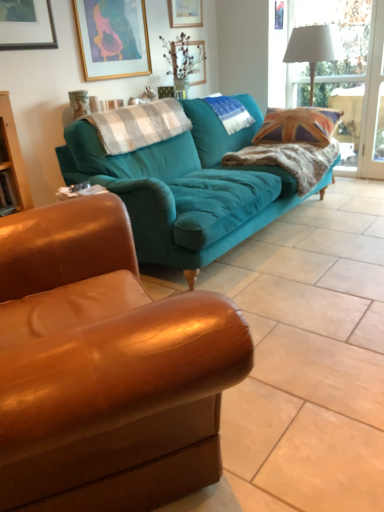
What do you see at coordinates (298, 126) in the screenshot?
I see `union jack fabric pillow at right` at bounding box center [298, 126].

What do you see at coordinates (185, 13) in the screenshot? I see `wooden picture frame at upper center, the first picture frame viewed from the top` at bounding box center [185, 13].

The image size is (384, 512). What do you see at coordinates (336, 74) in the screenshot?
I see `clear glass window at upper right` at bounding box center [336, 74].

Locate an element on the screen. The height and width of the screenshot is (512, 384). teal fabric pillow at center, acting as the 2th pillow starting from the front is located at coordinates (230, 113).

This screenshot has height=512, width=384. In order to click on union jack fabric pillow at right in this screenshot , I will do `click(298, 126)`.

Can you confirm if wooden picture frame at upper center, the 2th picture frame from the front, is bigger than teal fabric pillow at center, acting as the 2th pillow starting from the front?

No, wooden picture frame at upper center, the 2th picture frame from the front, is not bigger than teal fabric pillow at center, acting as the 2th pillow starting from the front.

Is wooden picture frame at upper center, the 2th picture frame from the front, not near teal fabric pillow at center, the first pillow when ordered from right to left?

No, wooden picture frame at upper center, the 2th picture frame from the front, is in close proximity to teal fabric pillow at center, the first pillow when ordered from right to left.

How different are the orientations of wooden picture frame at upper center, the 1th picture frame in the right-to-left sequence, and teal fabric pillow at center, acting as the 2th pillow starting from the front, in degrees?

The angle between the facing direction of wooden picture frame at upper center, the 1th picture frame in the right-to-left sequence, and the facing direction of teal fabric pillow at center, acting as the 2th pillow starting from the front, is 0.633 degrees.

Is point (180, 11) farther from viewer compared to point (243, 124)?

Yes, it is.

Is plaid fabric pillow at center, which appears as the 1th pillow when viewed from the front, wider than teal fabric pillow at center, acting as the 2th pillow starting from the front?

No.

Is point (99, 134) more distant than point (245, 124)?

No, it is in front of (245, 124).

Considering the sizes of objects plaid fabric pillow at center, which appears as the 1th pillow when viewed from the front, and teal fabric pillow at center, the first pillow when ordered from right to left, in the image provided, who is bigger, plaid fabric pillow at center, which appears as the 1th pillow when viewed from the front, or teal fabric pillow at center, the first pillow when ordered from right to left,?

Bigger between the two is teal fabric pillow at center, the first pillow when ordered from right to left.

How different are the orientations of teal fabric couch at center, arranged as the 2th studio couch when viewed from the back, and union jack fabric pillow at right in degrees?

The facing directions of teal fabric couch at center, arranged as the 2th studio couch when viewed from the back, and union jack fabric pillow at right are 58.8 degrees apart.

Does teal fabric couch at center, arranged as the 2th studio couch when viewed from the back, appear on the left side of union jack fabric pillow at right?

Correct, you'll find teal fabric couch at center, arranged as the 2th studio couch when viewed from the back, to the left of union jack fabric pillow at right.

Is teal fabric couch at center, arranged as the 2th studio couch when viewed from the back, wider than union jack fabric pillow at right?

Incorrect, the width of teal fabric couch at center, arranged as the 2th studio couch when viewed from the back, does not surpass that of union jack fabric pillow at right.

Considering the sizes of teal fabric couch at center, the first studio couch when ordered from front to back, and union jack fabric pillow at right in the image, is teal fabric couch at center, the first studio couch when ordered from front to back, bigger or smaller than union jack fabric pillow at right?

In the image, teal fabric couch at center, the first studio couch when ordered from front to back, appears to be larger than union jack fabric pillow at right.

From a real-world perspective, which is physically above, teal fabric pillow at center, the first pillow when ordered from right to left, or teal fabric couch at center, the 1th studio couch positioned from the back?

From a 3D spatial view, teal fabric pillow at center, the first pillow when ordered from right to left, is above.

From the picture: From the image's perspective, between teal fabric pillow at center, which is the second pillow from left to right, and teal fabric couch at center, the 1th studio couch positioned from the back, who is located below?

teal fabric couch at center, the 1th studio couch positioned from the back, is shown below in the image.

Which of these two, teal fabric pillow at center, the first pillow when ordered from right to left, or teal fabric couch at center, the 1th studio couch positioned from the back, is wider?

Wider between the two is teal fabric couch at center, the 1th studio couch positioned from the back.

In the scene shown: Does teal fabric pillow at center, the first pillow when ordered from right to left, have a greater height compared to teal fabric couch at center, marked as the second studio couch in a front-to-back arrangement?

No, teal fabric pillow at center, the first pillow when ordered from right to left, is not taller than teal fabric couch at center, marked as the second studio couch in a front-to-back arrangement.

Between teal fabric couch at center, the 1th studio couch positioned from the back, and teal fabric pillow at center, the first pillow when ordered from right to left, which one is positioned in front?

teal fabric couch at center, the 1th studio couch positioned from the back, is in front.

Which object is positioned more to the right, teal fabric couch at center, the 1th studio couch positioned from the back, or teal fabric pillow at center, acting as the 2th pillow starting from the front?

teal fabric pillow at center, acting as the 2th pillow starting from the front.

How different are the orientations of teal fabric couch at center, marked as the second studio couch in a front-to-back arrangement, and teal fabric pillow at center, which is the second pillow from left to right, in degrees?

0.775 degrees separate the facing orientations of teal fabric couch at center, marked as the second studio couch in a front-to-back arrangement, and teal fabric pillow at center, which is the second pillow from left to right.

Is clear glass window at upper right not near gold-framed artwork at upper center, which is the 2th picture frame from right to left?

Yes, clear glass window at upper right and gold-framed artwork at upper center, which is the 2th picture frame from right to left, are quite far apart.

Is clear glass window at upper right in front of or behind gold-framed artwork at upper center, placed as the second picture frame when sorted from back to front, in the image?

Visually, clear glass window at upper right is located behind gold-framed artwork at upper center, placed as the second picture frame when sorted from back to front.

Is point (335, 74) in front of point (112, 25)?

No.

Is clear glass window at upper right at the right side of gold-framed artwork at upper center, which is counted as the 1th picture frame, starting from the front?

Indeed, clear glass window at upper right is positioned on the right side of gold-framed artwork at upper center, which is counted as the 1th picture frame, starting from the front.

Which is closer, (280,112) or (17,296)?

The point (17,296) is more forward.

Could you tell me if union jack fabric pillow at right is facing teal fabric couch at center, the first studio couch when ordered from front to back?

No, union jack fabric pillow at right is not facing towards teal fabric couch at center, the first studio couch when ordered from front to back.

How distant is union jack fabric pillow at right from teal fabric couch at center, arranged as the 2th studio couch when viewed from the back?

They are 7.54 feet apart.

Consider the image. Between union jack fabric pillow at right and teal fabric couch at center, arranged as the 2th studio couch when viewed from the back, which one has larger width?

With larger width is union jack fabric pillow at right.

From the image's perspective, starting from the wooden picture frame at upper center, placed as the second picture frame when sorted from left to right, which pillow is the 1st one below? Please provide its 2D coordinates.

[(230, 113)]

At what (x,y) coordinates should I click in order to perform the action: click on pillow to the right of plaid fabric pillow at center, which ranks as the second pillow in back-to-front order. Please return your answer as a coordinate pair (x, y). Looking at the image, I should click on (230, 113).

Considering their positions, is teal fabric pillow at center, the 1th pillow when ordered from back to front, positioned closer to gold-framed artwork at upper center, acting as the first picture frame starting from the left, than union jack fabric pillow at right?

teal fabric pillow at center, the 1th pillow when ordered from back to front, lies closer to gold-framed artwork at upper center, acting as the first picture frame starting from the left, than the other object.

Considering their positions, is teal fabric couch at center, marked as the second studio couch in a front-to-back arrangement, positioned further to gold-framed artwork at upper center, acting as the first picture frame starting from the left, than plaid fabric pillow at center, which is the first pillow from left to right?

Based on the image, teal fabric couch at center, marked as the second studio couch in a front-to-back arrangement, appears to be further to gold-framed artwork at upper center, acting as the first picture frame starting from the left.

Which object lies nearer to the anchor point teal fabric couch at center, arranged as the 2th studio couch when viewed from the back, teal fabric pillow at center, the first pillow when ordered from right to left, or clear glass window at upper right?

teal fabric pillow at center, the first pillow when ordered from right to left, is positioned closer to the anchor teal fabric couch at center, arranged as the 2th studio couch when viewed from the back.

Looking at the image, which one is located further to union jack fabric pillow at right, teal fabric couch at center, arranged as the 2th studio couch when viewed from the back, or clear glass window at upper right?

Based on the image, teal fabric couch at center, arranged as the 2th studio couch when viewed from the back, appears to be further to union jack fabric pillow at right.

Looking at the image, which one is located further to white fabric lampshade at upper right, teal fabric couch at center, the 1th studio couch positioned from the back, or teal fabric pillow at center, acting as the 2th pillow starting from the front?

teal fabric couch at center, the 1th studio couch positioned from the back, is positioned further to the anchor white fabric lampshade at upper right.

Consider the image. Looking at the image, which one is located closer to clear glass window at upper right, union jack fabric pillow at right or wooden picture frame at upper center, which is the 1th picture frame from back to front?

union jack fabric pillow at right is closer to clear glass window at upper right.

Which object lies further to the anchor point teal fabric couch at center, the 1th studio couch positioned from the back, teal fabric pillow at center, the 1th pillow when ordered from back to front, or white fabric lampshade at upper right?

white fabric lampshade at upper right lies further to teal fabric couch at center, the 1th studio couch positioned from the back, than the other object.

When comparing their distances from plaid fabric pillow at center, which is the first pillow from left to right, does union jack fabric pillow at right or teal fabric pillow at center, acting as the 2th pillow starting from the front, seem further?

Based on the image, union jack fabric pillow at right appears to be further to plaid fabric pillow at center, which is the first pillow from left to right.

In order to click on lamp between teal fabric couch at center, arranged as the 2th studio couch when viewed from the back, and teal fabric pillow at center, the first pillow when ordered from right to left, in the front-back direction in this screenshot , I will do `click(313, 48)`.

Identify the location of throw pillow between teal fabric couch at center, the first studio couch when ordered from front to back, and wooden picture frame at upper center, placed as the second picture frame when sorted from left to right, in the front-back direction. This screenshot has height=512, width=384. (298, 126).

I want to click on lamp located between wooden picture frame at upper center, placed as the second picture frame when sorted from left to right, and clear glass window at upper right in the left-right direction, so click(x=313, y=48).

Identify the location of studio couch positioned between teal fabric couch at center, arranged as the 2th studio couch when viewed from the back, and clear glass window at upper right from near to far. (185, 187).